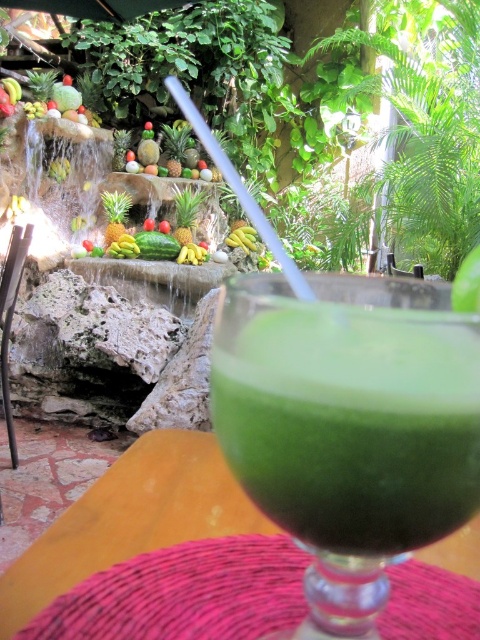
Question: Where is yellow smooth banana at center located in relation to yellow smooth bananas at center in the image?

Choices:
 (A) right
 (B) left

Answer: (A)

Question: Which object is the closest to the wooden table at center?

Choices:
 (A) green matte pineapple at center
 (B) yellow smooth bananas at center

Answer: (B)

Question: Is green frothy smoothie at center positioned at the back of yellow smooth banana at center?

Choices:
 (A) yes
 (B) no

Answer: (B)

Question: Which object appears farthest from the camera in this image?

Choices:
 (A) wooden table at center
 (B) green matte pineapple at center
 (C) green frothy smoothie at center
 (D) yellow smooth banana at center

Answer: (D)

Question: Estimate the real-world distances between objects in this image. Which object is closer to the wooden table at center?

Choices:
 (A) yellow smooth bananas at center
 (B) green matte pineapple at center
 (C) yellow smooth banana at center

Answer: (A)

Question: Is yellow smooth banana at center further to the viewer compared to yellow smooth bananas at center?

Choices:
 (A) no
 (B) yes

Answer: (B)